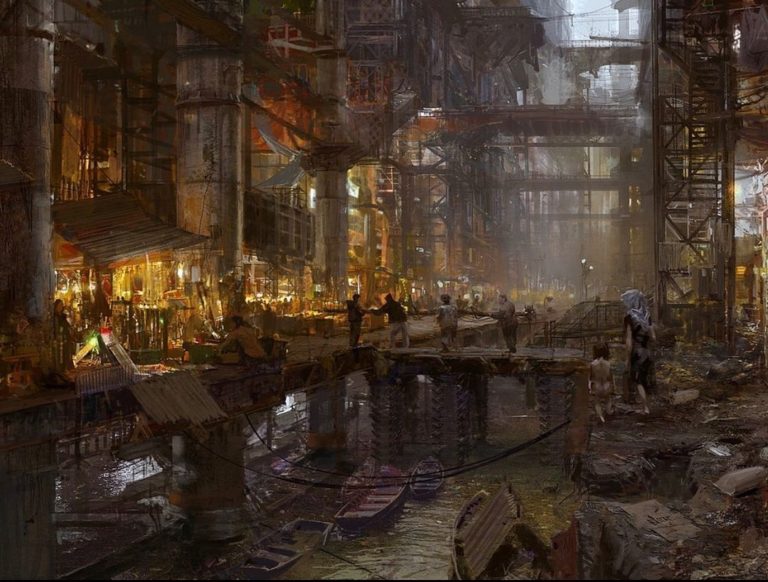
Image resolution: width=768 pixels, height=582 pixels. What are the coordinates of `stairs` in the screenshot? It's located at (706, 162), (709, 196), (707, 106).